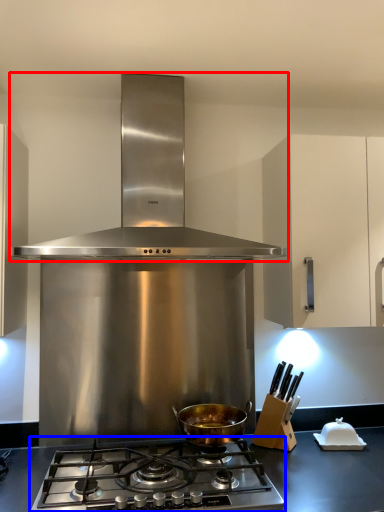
Question: Which object appears closest to the camera in this image, kitchen appliance (highlighted by a red box) or gas stove (highlighted by a blue box)?

Choices:
 (A) kitchen appliance
 (B) gas stove

Answer: (B)